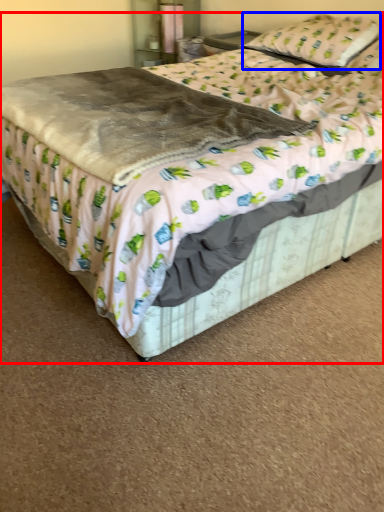
Question: Which object appears closest to the camera in this image, bed (highlighted by a red box) or pillow (highlighted by a blue box)?

Choices:
 (A) bed
 (B) pillow

Answer: (A)